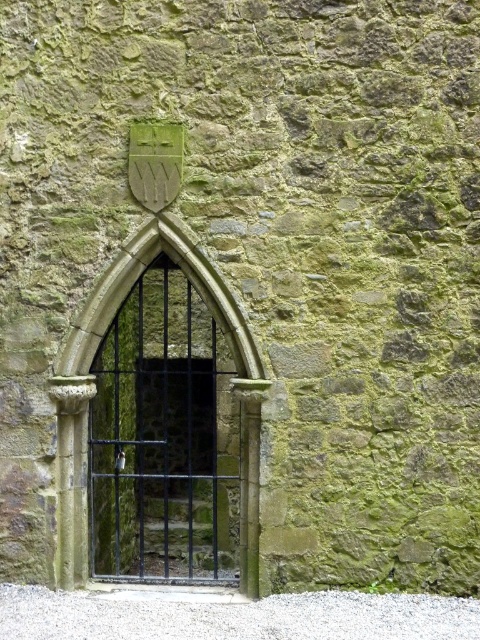
You are a gardener who wants to plant flowers between the white gravel at bottom and the black metal gate at center. Is there enough space between them to plant flowers?

The white gravel at bottom is positioned under the black metal gate at center, so there is no space between them to plant flowers.

You are a gardener planning to place a small decorative stone on the ground near the white gravel at bottom and the black metal gate at center. Which location would allow the stone to be more visible against the background?

The white gravel at bottom has a smaller size compared to the black metal gate at center. Placing the stone near the black metal gate at center would make it more visible because the larger gate provides a contrasting background against the smaller gravel.

You are standing at the base of the stone wall and want to place a small potted plant on the white gravel at bottom. Based on the scene description, where exactly should you place the potted plant?

The white gravel at bottom is located at point [232,616]. You should place the potted plant at that coordinate to ensure it is on the white gravel at bottom.